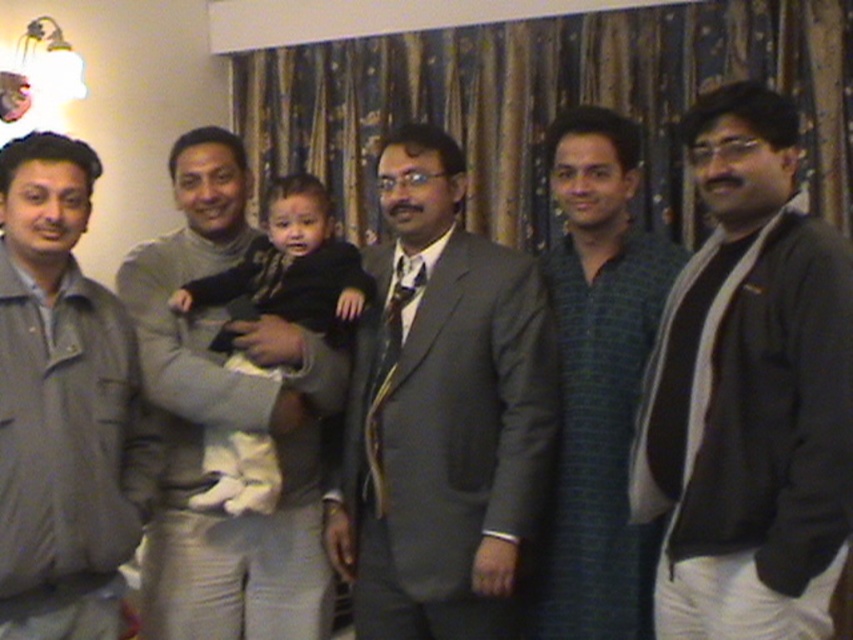
Question: Is matte gray suit at center smaller than gray fabric jacket at left?

Choices:
 (A) yes
 (B) no

Answer: (B)

Question: Which of the following is the farthest from the observer?

Choices:
 (A) soft white fabric baby at center
 (B) gray fabric jacket at left
 (C) dark gray sweater at right
 (D) matte gray suit at center

Answer: (A)

Question: Which object appears closest to the camera in this image?

Choices:
 (A) green striped shirt at center
 (B) soft white fabric baby at center
 (C) gray fabric jacket at left
 (D) dark gray sweater at right

Answer: (D)

Question: Can you confirm if gray fabric jacket at left is wider than green striped shirt at center?

Choices:
 (A) yes
 (B) no

Answer: (B)

Question: Which point is closer to the camera?

Choices:
 (A) (683, 316)
 (B) (148, 464)

Answer: (A)

Question: Can you confirm if dark gray sweater at right is wider than green striped shirt at center?

Choices:
 (A) no
 (B) yes

Answer: (B)